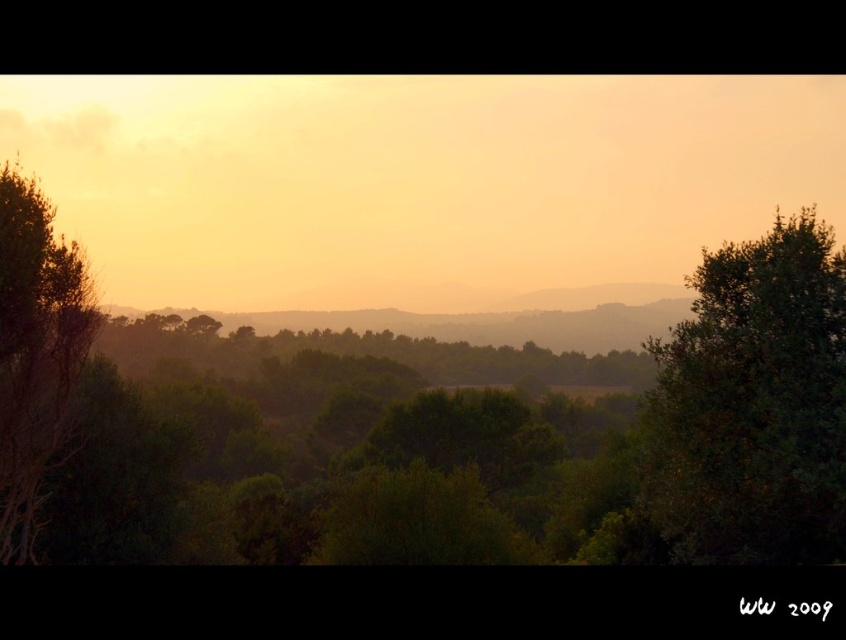
Between green leafy tree at right and green leafy tree at left, which one appears on the right side from the viewer's perspective?

green leafy tree at right is more to the right.

Can you confirm if green leafy tree at right is thinner than green leafy tree at left?

No, green leafy tree at right is not thinner than green leafy tree at left.

Find the location of a particular element. This screenshot has width=846, height=640. green leafy tree at right is located at coordinates (754, 403).

The height and width of the screenshot is (640, 846). I want to click on green leafy tree at right, so click(754, 403).